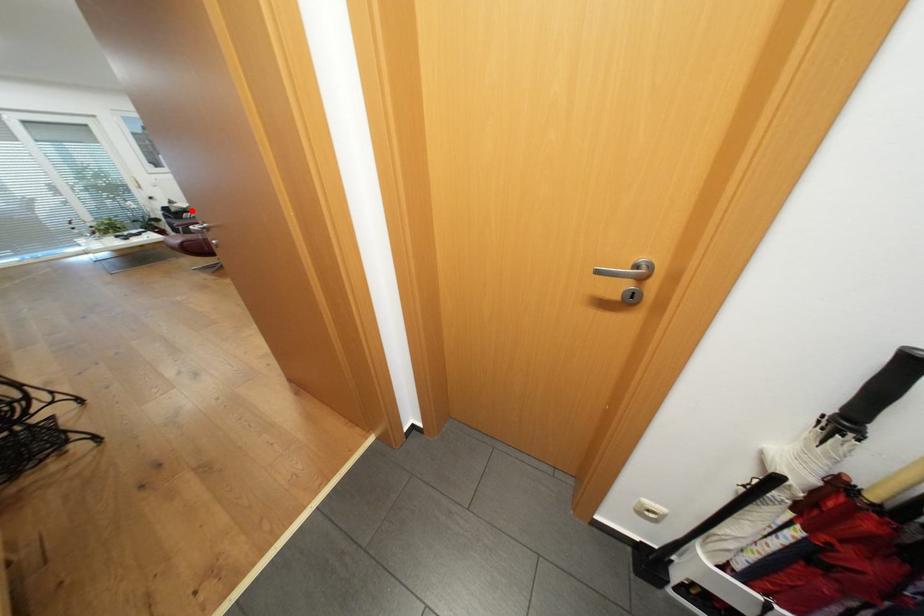
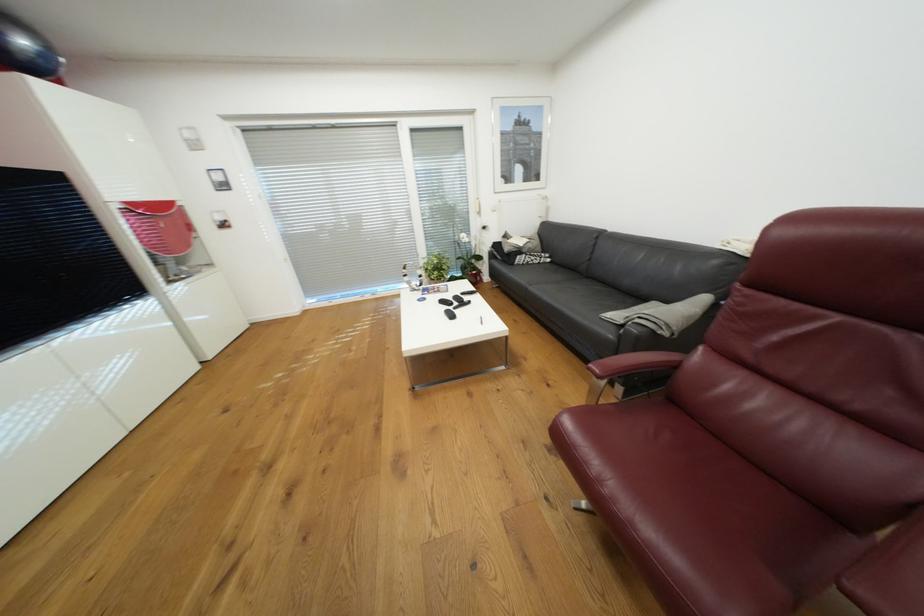
In the second image, find the point that corresponds to the highlighted location in the first image.

(526, 252)